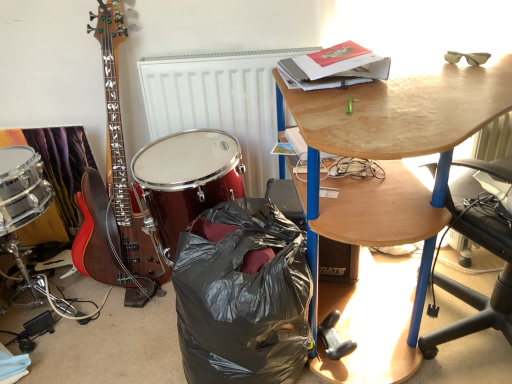
Question: Is white textured radiator at center looking in the opposite direction of wooden desk at upper right?

Choices:
 (A) no
 (B) yes

Answer: (A)

Question: Is white textured radiator at center positioned beyond the bounds of wooden desk at upper right?

Choices:
 (A) no
 (B) yes

Answer: (B)

Question: From a real-world perspective, is white textured radiator at center positioned over wooden desk at upper right based on gravity?

Choices:
 (A) no
 (B) yes

Answer: (B)

Question: Is white textured radiator at center closer to the viewer compared to wooden desk at upper right?

Choices:
 (A) yes
 (B) no

Answer: (B)

Question: From the image's perspective, does white textured radiator at center appear lower than wooden desk at upper right?

Choices:
 (A) no
 (B) yes

Answer: (A)

Question: Does white textured radiator at center have a smaller size compared to wooden desk at upper right?

Choices:
 (A) no
 (B) yes

Answer: (B)

Question: Can you confirm if black plastic loudspeaker at lower center is shorter than white textured radiator at center?

Choices:
 (A) yes
 (B) no

Answer: (A)

Question: Is black plastic loudspeaker at lower center facing away from white textured radiator at center?

Choices:
 (A) no
 (B) yes

Answer: (A)

Question: From a real-world perspective, is black plastic loudspeaker at lower center over white textured radiator at center?

Choices:
 (A) yes
 (B) no

Answer: (B)

Question: Are black plastic loudspeaker at lower center and white textured radiator at center far apart?

Choices:
 (A) yes
 (B) no

Answer: (B)

Question: Does black plastic loudspeaker at lower center turn towards white textured radiator at center?

Choices:
 (A) yes
 (B) no

Answer: (B)

Question: Does black plastic loudspeaker at lower center appear on the right side of white textured radiator at center?

Choices:
 (A) yes
 (B) no

Answer: (A)

Question: Considering the relative positions of black plastic bag at lower center and black plastic loudspeaker at lower center in the image provided, is black plastic bag at lower center to the left of black plastic loudspeaker at lower center from the viewer's perspective?

Choices:
 (A) yes
 (B) no

Answer: (A)